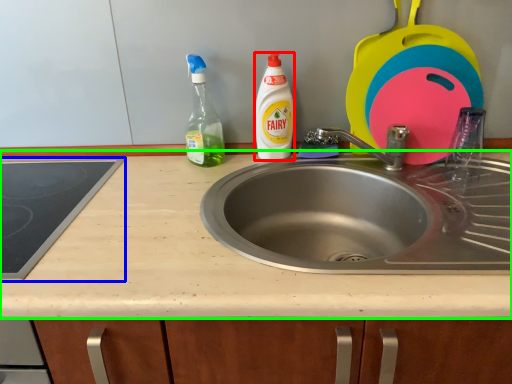
Question: Which object is positioned farthest from cleaning product (highlighted by a red box)? Select from gas stove (highlighted by a blue box) and countertop (highlighted by a green box).

Choices:
 (A) gas stove
 (B) countertop

Answer: (A)